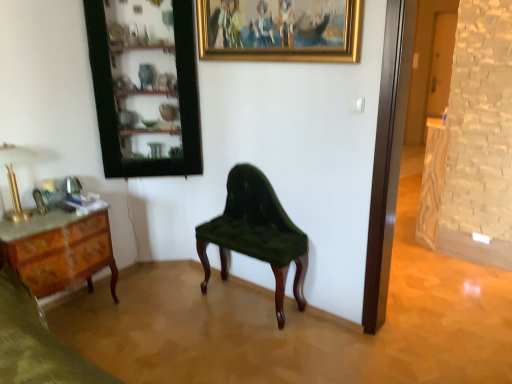
Question: Is marble top wood desk at left located outside wooden cabinet at upper left?

Choices:
 (A) no
 (B) yes

Answer: (B)

Question: From a real-world perspective, is marble top wood desk at left located beneath wooden cabinet at upper left?

Choices:
 (A) no
 (B) yes

Answer: (B)

Question: From the image's perspective, would you say marble top wood desk at left is shown under wooden cabinet at upper left?

Choices:
 (A) yes
 (B) no

Answer: (A)

Question: Considering the relative sizes of marble top wood desk at left and wooden cabinet at upper left in the image provided, is marble top wood desk at left thinner than wooden cabinet at upper left?

Choices:
 (A) no
 (B) yes

Answer: (A)

Question: Is marble top wood desk at left surrounding wooden cabinet at upper left?

Choices:
 (A) yes
 (B) no

Answer: (B)

Question: Does marble top wood desk at left appear on the left side of wooden cabinet at upper left?

Choices:
 (A) no
 (B) yes

Answer: (B)

Question: Considering the relative sizes of wooden cabinet at upper left and gold polished metal lamp at left in the image provided, is wooden cabinet at upper left thinner than gold polished metal lamp at left?

Choices:
 (A) yes
 (B) no

Answer: (B)

Question: Is wooden cabinet at upper left to the right of gold polished metal lamp at left from the viewer's perspective?

Choices:
 (A) yes
 (B) no

Answer: (A)

Question: Is wooden cabinet at upper left directly adjacent to gold polished metal lamp at left?

Choices:
 (A) no
 (B) yes

Answer: (A)

Question: Does wooden cabinet at upper left have a greater width compared to gold polished metal lamp at left?

Choices:
 (A) yes
 (B) no

Answer: (A)

Question: Is wooden cabinet at upper left bigger than gold polished metal lamp at left?

Choices:
 (A) yes
 (B) no

Answer: (A)

Question: Is wooden cabinet at upper left not near gold polished metal lamp at left?

Choices:
 (A) no
 (B) yes

Answer: (A)

Question: From a real-world perspective, does velvet green chair at center stand above wooden cabinet at upper left?

Choices:
 (A) no
 (B) yes

Answer: (A)